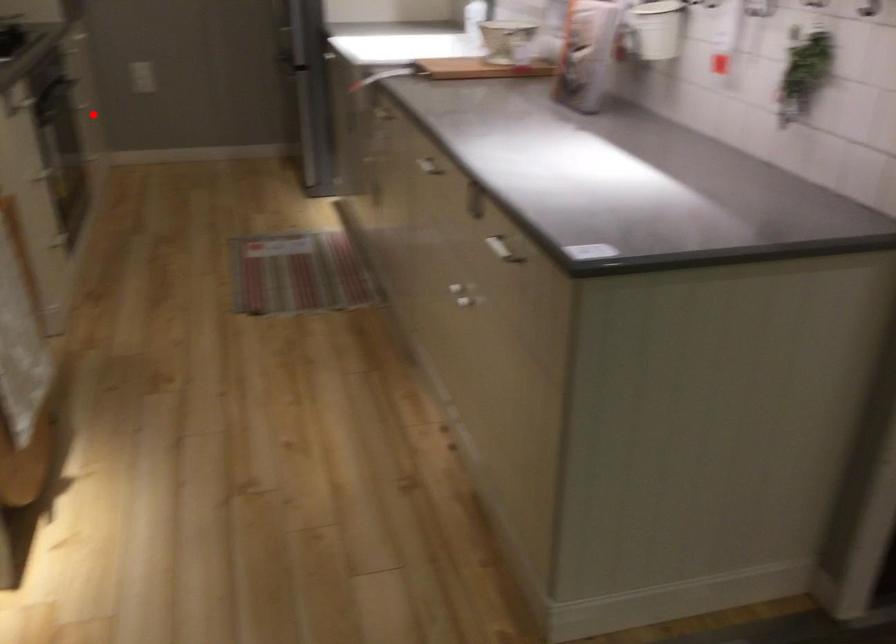
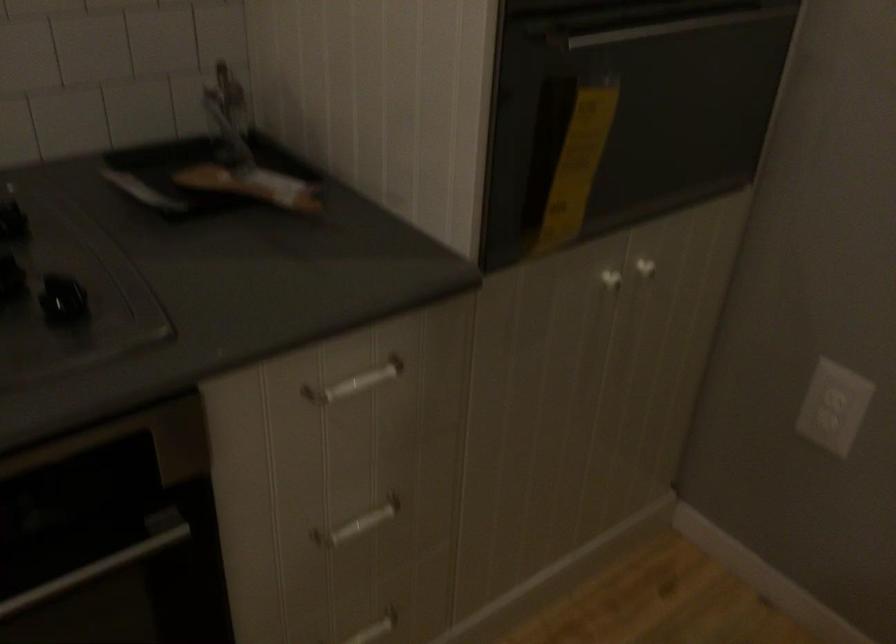
The point at the highlighted location is marked in the first image. Where is the corresponding point in the second image?

(358, 524)